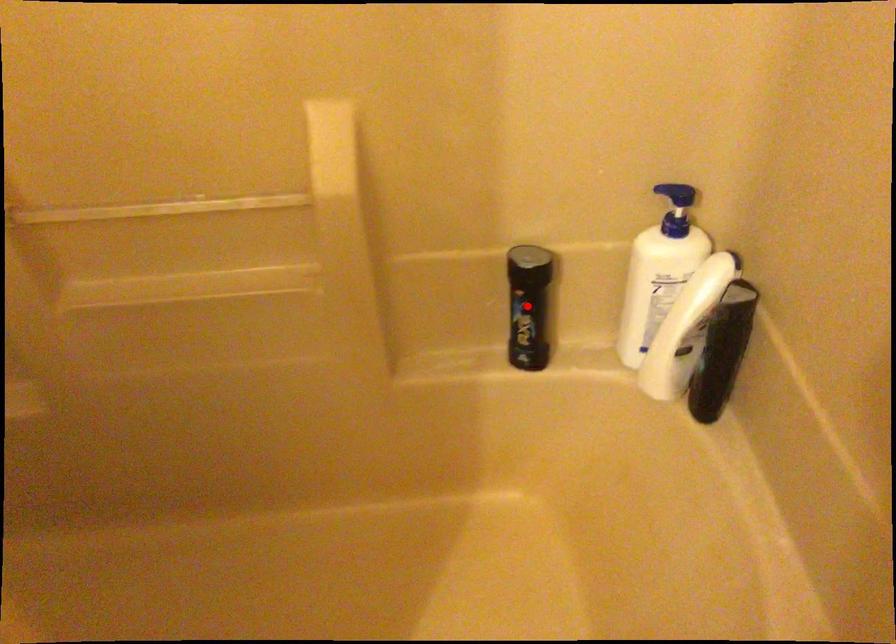
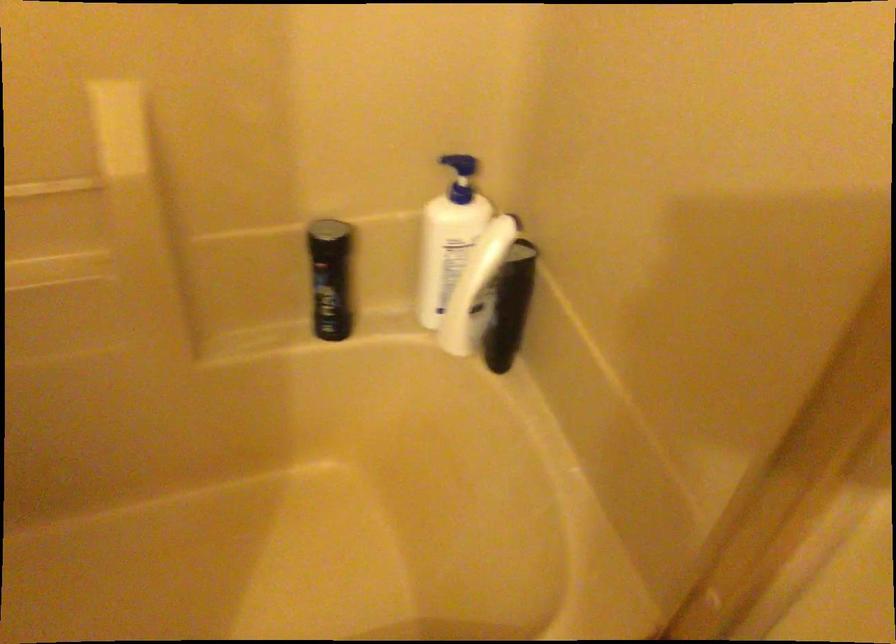
Question: I am providing you with two images of the same scene from different viewpoints. A red point is marked on the first image. At the location where the point appears in image 1, is it still visible in image 2?

Choices:
 (A) Yes
 (B) No

Answer: (A)